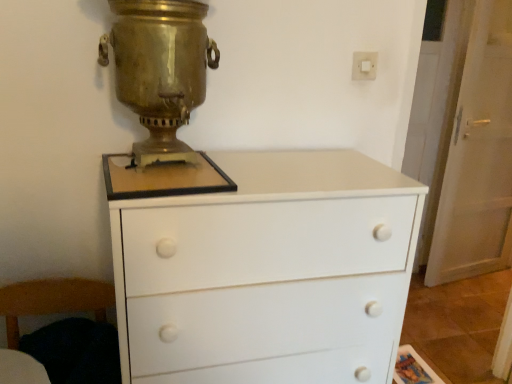
Question: Looking at their shapes, would you say white plastic switch at upper right is wider or thinner than wooden armchair at lower left?

Choices:
 (A) wide
 (B) thin

Answer: (B)

Question: Based on their sizes in the image, would you say white plastic switch at upper right is bigger or smaller than wooden armchair at lower left?

Choices:
 (A) big
 (B) small

Answer: (B)

Question: Estimate the real-world distances between objects in this image. Which object is closer to the white plastic switch at upper right?

Choices:
 (A) wooden armchair at lower left
 (B) white glossy door at right
 (C) gold polished samovar at center
 (D) white matte chest of drawers at center

Answer: (C)

Question: Which object is the farthest from the gold polished samovar at center?

Choices:
 (A) wooden armchair at lower left
 (B) white plastic switch at upper right
 (C) white glossy door at right
 (D) white matte chest of drawers at center

Answer: (C)